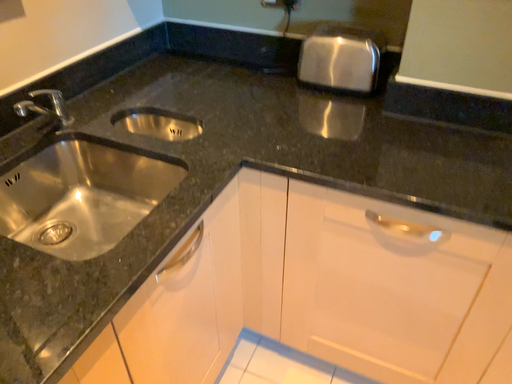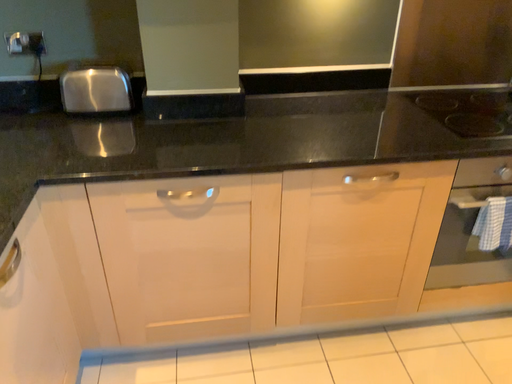
Question: How did the camera likely rotate when shooting the video?

Choices:
 (A) rotated right
 (B) rotated left

Answer: (A)